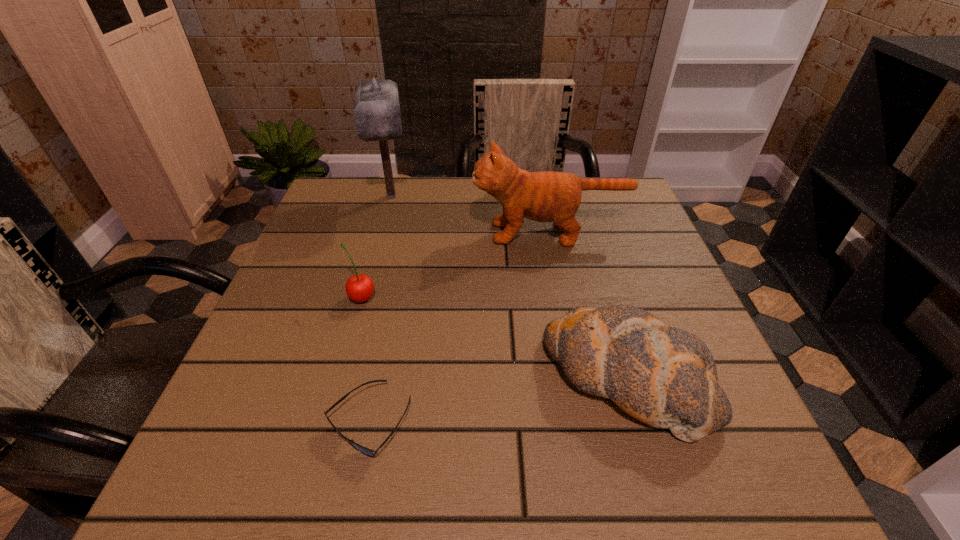
Choose which object is the third nearest neighbor to the cherry. Please provide its 2D coordinates. Your answer should be formatted as a tuple, i.e. [(x, y)], where the tuple contains the x and y coordinates of a point satisfying the conditions above.

[(376, 109)]

Identify which object is the closest to the cherry. Please provide its 2D coordinates. Your answer should be formatted as a tuple, i.e. [(x, y)], where the tuple contains the x and y coordinates of a point satisfying the conditions above.

[(368, 452)]

This screenshot has height=540, width=960. Identify the location of free space in the image that satisfies the following two spatial constraints: 1. on the face of the second tallest object; 2. on the left side of the bread. (577, 379).

Identify the location of vacant space that satisfies the following two spatial constraints: 1. on the face of the cat; 2. on the back side of the bread. This screenshot has height=540, width=960. (577, 379).

The height and width of the screenshot is (540, 960). I want to click on free space that satisfies the following two spatial constraints: 1. on the face of the fourth shortest object; 2. on the back side of the bread, so click(577, 379).

Identify the location of free location that satisfies the following two spatial constraints: 1. on the face of the bread; 2. on the right side of the fourth shortest object. (577, 379).